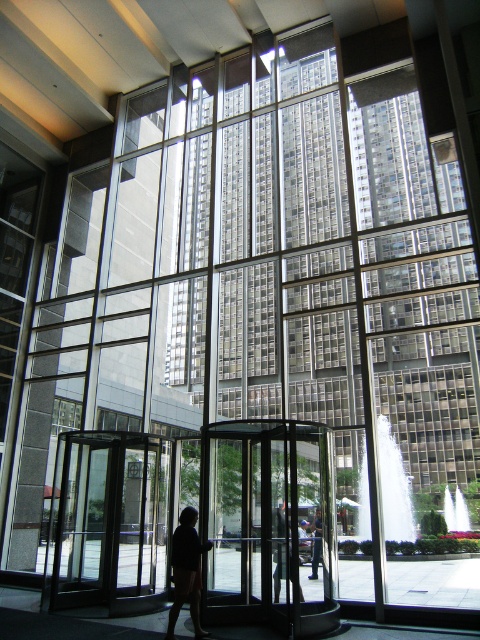
Question: Based on their relative distances, which object is farther from the transparent glass door at left?

Choices:
 (A) dark fabric jacket at center
 (B) transparent glass door at center

Answer: (A)

Question: Considering the relative positions of transparent glass door at center and black fabric person at center in the image provided, where is transparent glass door at center located with respect to black fabric person at center?

Choices:
 (A) above
 (B) below

Answer: (B)

Question: Which point is closer to the camera?

Choices:
 (A) (133, 598)
 (B) (279, 550)

Answer: (A)

Question: Is transparent glass door at left below black fabric person at center?

Choices:
 (A) no
 (B) yes

Answer: (B)

Question: Which object is positioned closest to the transparent glass door at left?

Choices:
 (A) black fabric person at center
 (B) dark blue jeans at center

Answer: (B)

Question: Can you confirm if transparent glass door at left is wider than black fabric person at center?

Choices:
 (A) yes
 (B) no

Answer: (A)